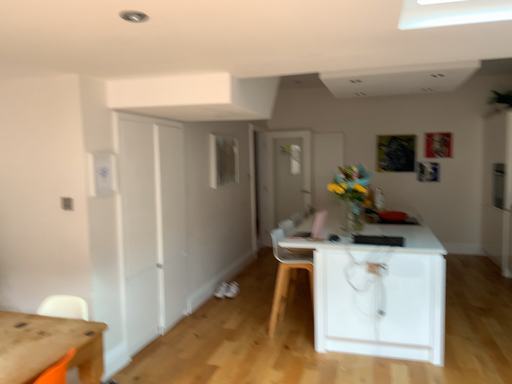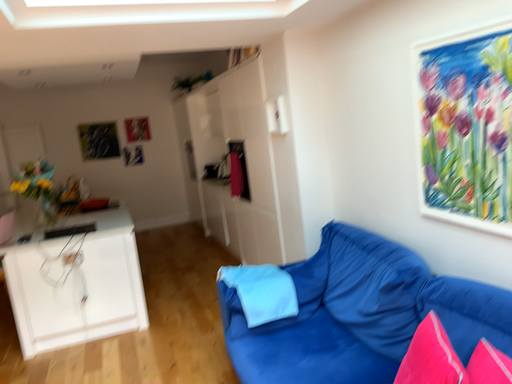
Question: How did the camera likely rotate when shooting the video?

Choices:
 (A) rotated right
 (B) rotated left

Answer: (A)